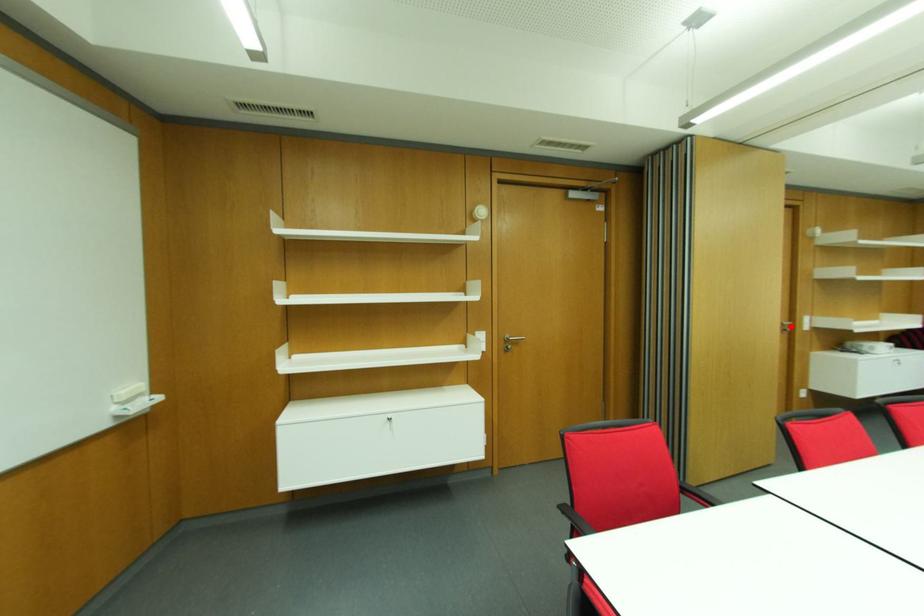
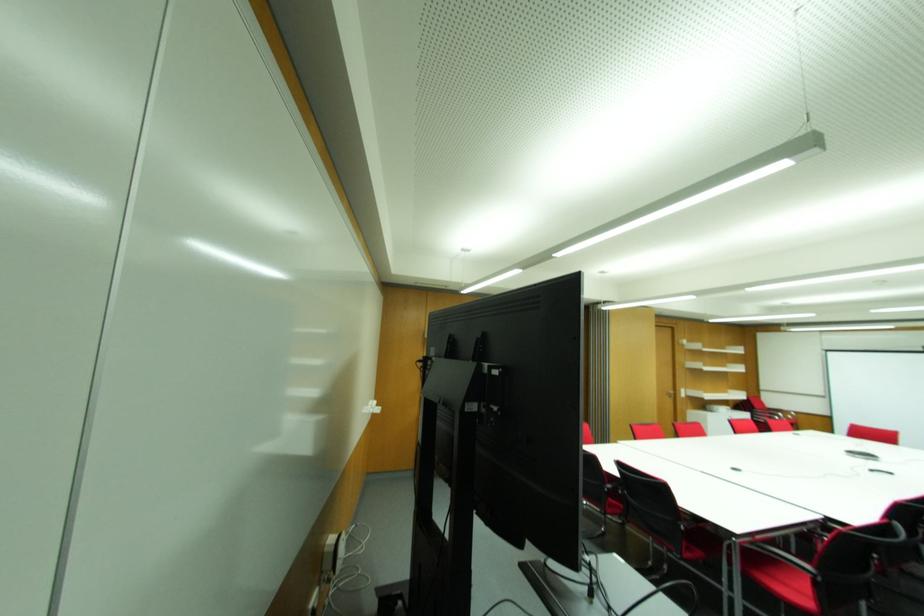
In the second image, find the point that corresponds to the highlighted location in the first image.

(675, 394)